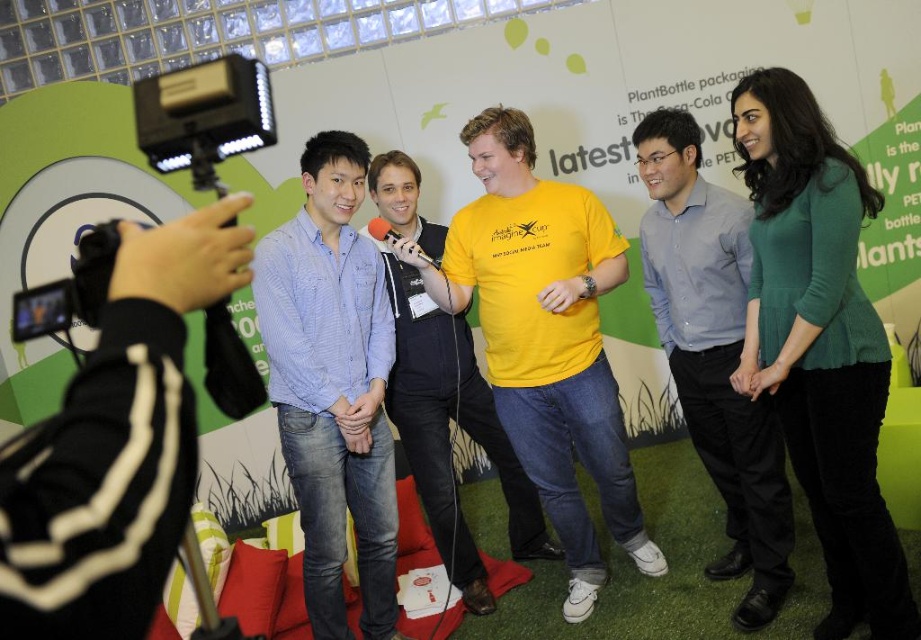
What is the exact coordinate of the green matte sweater at center?

The green matte sweater at center is located at point (819, 342).

You are standing at the origin point in the center of the image. You want to move towards the point labeled point (815, 160). Will you pass by the point labeled point (704, 394) first before reaching your destination?

Since point (815, 160) is in front of point (704, 394), you will reach point (815, 160) before passing point (704, 394). Therefore, you will not pass by point (704, 394) first before reaching your destination.